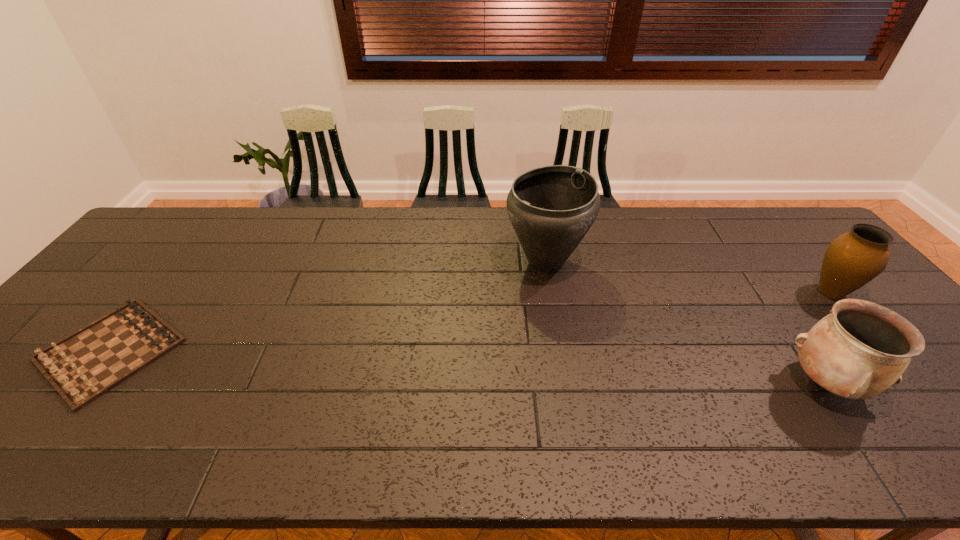
This screenshot has height=540, width=960. In order to click on the leftmost urn in this screenshot , I will do `click(551, 208)`.

You are a GUI agent. You are given a task and a screenshot of the screen. Output one action in this format:
    pyautogui.click(x=<x>, y=<y>)
    Task: Click on the second object from left to right
    This screenshot has height=540, width=960.
    Given the screenshot: What is the action you would take?
    pyautogui.click(x=551, y=208)

The width and height of the screenshot is (960, 540). In order to click on the rightmost urn in this screenshot , I will do `click(853, 259)`.

This screenshot has width=960, height=540. In order to click on the second urn from right to left in this screenshot , I will do `click(859, 350)`.

This screenshot has height=540, width=960. Identify the location of the third object from left to right. (859, 350).

I want to click on vacant region located on the right of the tallest object, so click(x=630, y=264).

Image resolution: width=960 pixels, height=540 pixels. Find the location of `free space located 0.330m on the left of the rightmost urn`. free space located 0.330m on the left of the rightmost urn is located at coordinates click(x=691, y=292).

Find the location of a particular element. vacant space located 0.110m on the right of the nearest urn is located at coordinates (910, 382).

Where is `object present at the far edge`? object present at the far edge is located at coordinates (551, 208).

Where is `object situated at the right edge`? This screenshot has width=960, height=540. object situated at the right edge is located at coordinates (853, 259).